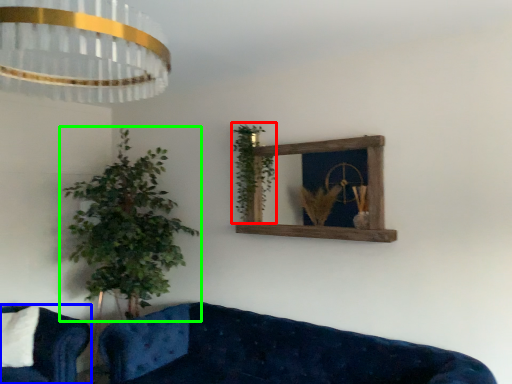
Question: Which is farther away from vegetation (highlighted by a red box)? studio couch (highlighted by a blue box) or houseplant (highlighted by a green box)?

Choices:
 (A) studio couch
 (B) houseplant

Answer: (A)